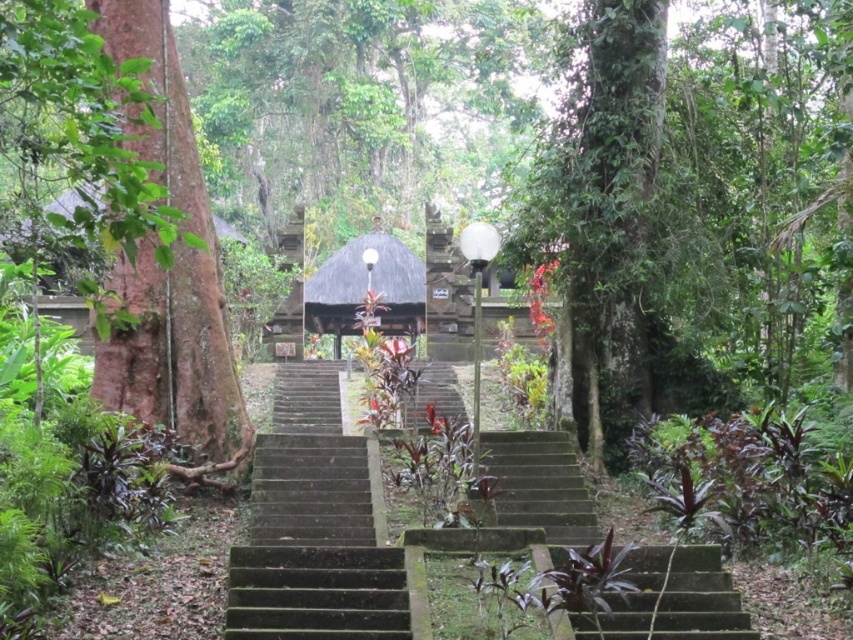
You are standing at the base of the stone steps in the tropical temple setting. There are two points marked on the steps. Which point, point (x=132, y=122) or point (x=418, y=424), is closer to you?

Point (x=132, y=122) is closer to you than point (x=418, y=424).

From the picture: You are a visitor at this tropical temple site and want to reach the dark brown thatched hut at center. Which direction should you move relative to the green stone stairs at center to get there?

The dark brown thatched hut at center is located to the left of the green stone stairs at center, so you should move towards the left side of the green stone stairs at center to reach it.

You are standing at the base of the stone steps leading to the thatched roof pavilion in the tropical temple. You notice two points marked in the scene. One is at coordinate point (x=132, y=385) and the other at point (x=718, y=573). Which point is closer to you as you face the steps?

Point (x=132, y=385) is closer to you because it is further to the viewer than point (x=718, y=573).